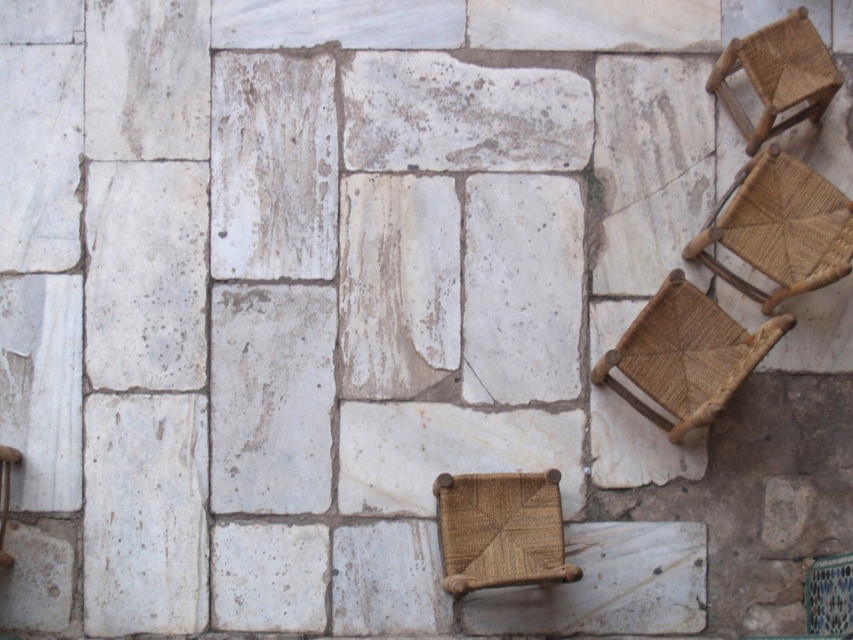
Who is taller, woven brown chair at upper right or woven brown stool at upper right?

woven brown chair at upper right is taller.

The width and height of the screenshot is (853, 640). What are the coordinates of `woven brown chair at upper right` in the screenshot? It's located at (779, 228).

Is brown woven chair at lower right wider than woven straw chair at lower right?

Yes.

Can you confirm if brown woven chair at lower right is positioned below woven straw chair at lower right?

Incorrect, brown woven chair at lower right is not positioned below woven straw chair at lower right.

The height and width of the screenshot is (640, 853). In order to click on brown woven chair at lower right in this screenshot , I will do `click(685, 355)`.

Identify the location of brown woven chair at lower right. The height and width of the screenshot is (640, 853). (685, 355).

Which is more to the right, woven brown chair at upper right or woven straw chair at lower right?

woven straw chair at lower right is more to the right.

Which is behind, point (773, 188) or point (849, 561)?

The point (773, 188) is behind.

Identify the location of woven brown chair at upper right. (779, 228).